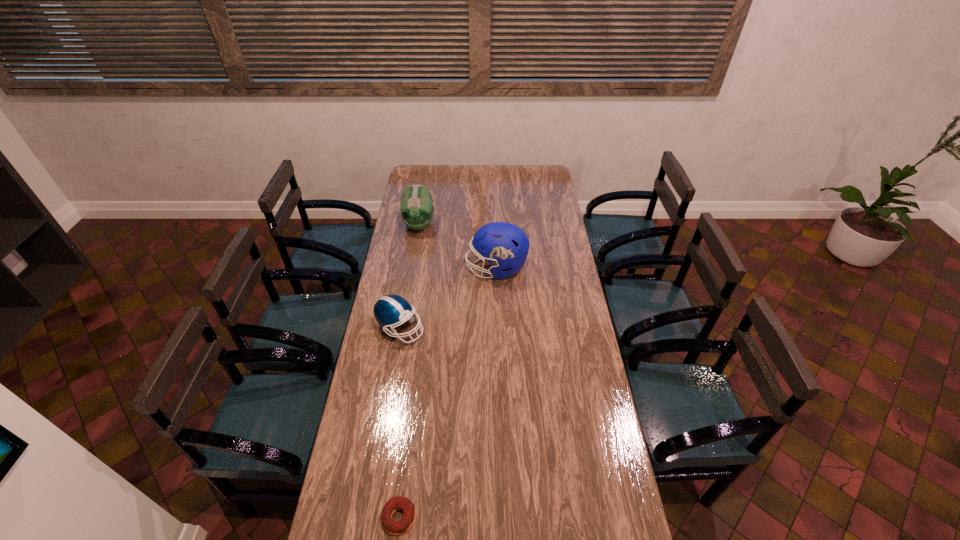
You are a GUI agent. You are given a task and a screenshot of the screen. Output one action in this format:
    pyautogui.click(x=<x>, y=<y>)
    Task: Click on the free space located on the front-facing side of the third nearest object
    
    Given the screenshot: What is the action you would take?
    pyautogui.click(x=429, y=268)

Where is `free point located on the visor of the second tallest object`? The height and width of the screenshot is (540, 960). free point located on the visor of the second tallest object is located at coordinates (415, 251).

The height and width of the screenshot is (540, 960). Find the location of `vacant space situated at the front of the nearest football helmet with the faceguard`. vacant space situated at the front of the nearest football helmet with the faceguard is located at coordinates (518, 328).

You are a GUI agent. You are given a task and a screenshot of the screen. Output one action in this format:
    pyautogui.click(x=<x>, y=<y>)
    Task: Click on the free space located on the back of the nearest object
    The height and width of the screenshot is (540, 960).
    Given the screenshot: What is the action you would take?
    [x=406, y=461]

At what (x,y) coordinates should I click in order to perform the action: click on doughnut that is at the left edge. Please return your answer as a coordinate pair (x, y). Looking at the image, I should click on (401, 526).

You are a GUI agent. You are given a task and a screenshot of the screen. Output one action in this format:
    pyautogui.click(x=<x>, y=<y>)
    Task: Click on the free space at the far edge
    Image resolution: width=960 pixels, height=540 pixels.
    Given the screenshot: What is the action you would take?
    point(476,180)

Image resolution: width=960 pixels, height=540 pixels. In the image, there is a desktop. In order to click on vacant area at the left edge in this screenshot , I will do `click(412, 237)`.

In the image, there is a desktop. In order to click on vacant region at the right edge in this screenshot , I will do `click(534, 186)`.

In the image, there is a desktop. Where is `vacant space at the far left corner`? The image size is (960, 540). vacant space at the far left corner is located at coordinates (411, 169).

Locate an element on the screen. Image resolution: width=960 pixels, height=540 pixels. free space between the second nearest football helmet and the shortest object is located at coordinates (447, 393).